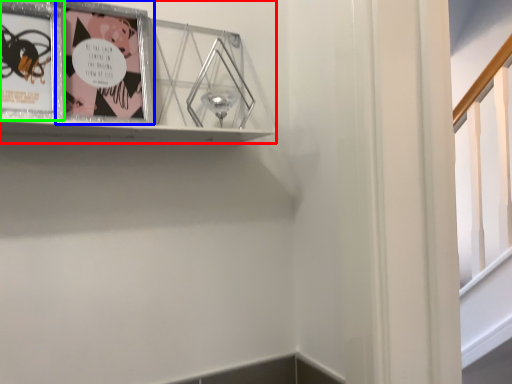
Question: Which object is the closest to the picture frame (highlighted by a red box)? Choose among these: picture frame (highlighted by a blue box) or picture frame (highlighted by a green box).

Choices:
 (A) picture frame
 (B) picture frame

Answer: (A)